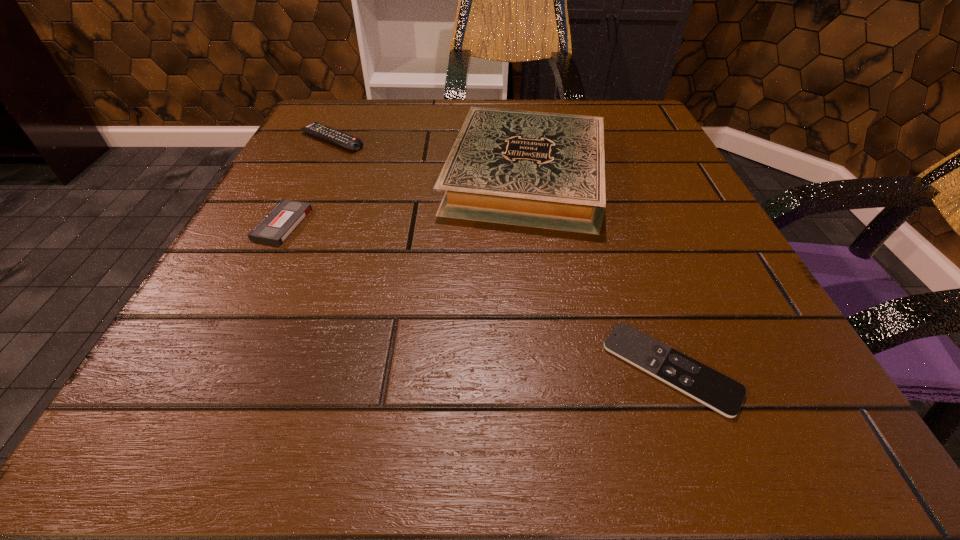
The height and width of the screenshot is (540, 960). Find the location of `vacant area that lies between the tallest object and the second tallest object`. vacant area that lies between the tallest object and the second tallest object is located at coordinates [x=429, y=158].

This screenshot has height=540, width=960. Identify the location of free area in between the tallest object and the videotape. (404, 199).

At what (x,y) coordinates should I click in order to perform the action: click on empty space that is in between the shortest object and the tallest object. Please return your answer as a coordinate pair (x, y). Looking at the image, I should click on (598, 272).

The width and height of the screenshot is (960, 540). Find the location of `vacant space that's between the hardback book and the videotape`. vacant space that's between the hardback book and the videotape is located at coordinates (404, 199).

The image size is (960, 540). In order to click on empty space between the right remote control and the tallest object in this screenshot , I will do `click(598, 272)`.

Find the location of a particular element. This screenshot has width=960, height=540. free space that is in between the hardback book and the left remote control is located at coordinates point(429,158).

The width and height of the screenshot is (960, 540). Find the location of `free space between the tallest object and the videotape`. free space between the tallest object and the videotape is located at coordinates (404, 199).

Where is `empty space between the tallest object and the videotape`? empty space between the tallest object and the videotape is located at coordinates (404, 199).

You are a GUI agent. You are given a task and a screenshot of the screen. Output one action in this format:
    pyautogui.click(x=<x>, y=<y>)
    Task: Click on the object that is the second closest to the left remote control
    The width and height of the screenshot is (960, 540).
    Given the screenshot: What is the action you would take?
    pyautogui.click(x=283, y=219)

Identify which object is the third nearest to the third shortest object. Please provide its 2D coordinates. Your answer should be formatted as a tuple, i.e. [(x, y)], where the tuple contains the x and y coordinates of a point satisfying the conditions above.

[(713, 389)]